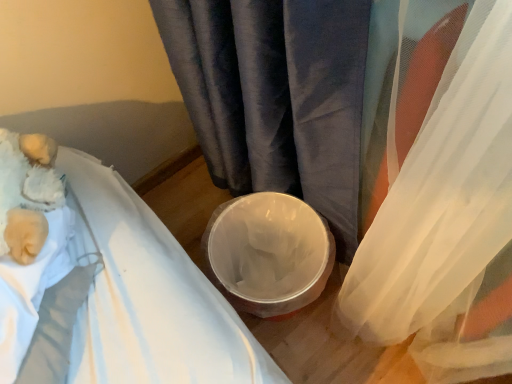
At what (x,y) coordinates should I click in order to perform the action: click on white plastic bowl at center. Please return your answer as a coordinate pair (x, y). Looking at the image, I should click on (269, 253).

What do you see at coordinates (269, 253) in the screenshot? I see `white plastic bowl at center` at bounding box center [269, 253].

What is the approximate width of white plastic bowl at center?

white plastic bowl at center is 9.35 inches in width.

The image size is (512, 384). What are the coordinates of `white plastic bowl at center` in the screenshot? It's located at (269, 253).